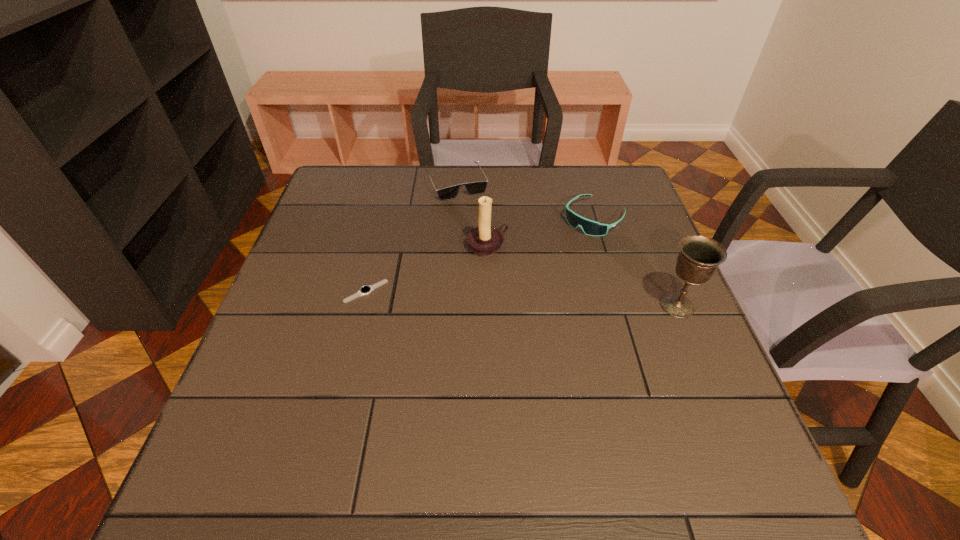
I want to click on chalice located at the right edge, so click(x=699, y=257).

Image resolution: width=960 pixels, height=540 pixels. I want to click on sunglasses that is at the right edge, so click(x=592, y=228).

This screenshot has width=960, height=540. I want to click on object located at the far right corner, so click(x=592, y=228).

In the image, there is a desktop. At what (x,y) coordinates should I click in order to perform the action: click on free space at the far edge. Please return your answer as a coordinate pair (x, y). This screenshot has width=960, height=540. Looking at the image, I should click on (548, 201).

In the image, there is a desktop. At what (x,y) coordinates should I click in order to perform the action: click on free space at the near edge. Please return your answer as a coordinate pair (x, y). This screenshot has height=540, width=960. Looking at the image, I should click on (473, 422).

The height and width of the screenshot is (540, 960). Identify the location of vacant space at the left edge of the desktop. (315, 234).

In the image, there is a desktop. Where is `vacant region at the right edge`? The width and height of the screenshot is (960, 540). vacant region at the right edge is located at coordinates (607, 260).

The height and width of the screenshot is (540, 960). Find the location of `vacant space at the far left corner of the desktop`. vacant space at the far left corner of the desktop is located at coordinates (328, 206).

This screenshot has width=960, height=540. In the image, there is a desktop. Find the location of `vacant space at the near left corner`. vacant space at the near left corner is located at coordinates (263, 404).

At what (x,y) coordinates should I click in order to perform the action: click on vacant space at the far right corner of the desktop. Please return your answer as a coordinate pair (x, y). The width and height of the screenshot is (960, 540). Looking at the image, I should click on (632, 190).